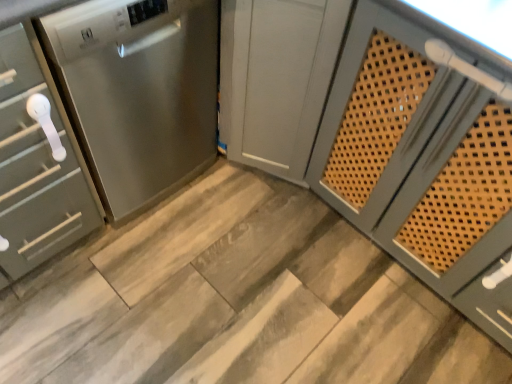
Question: Is satin silver cabinet at left, which is the 1th cabinetry in left-to-right order, further to the viewer compared to wooden at center?

Choices:
 (A) no
 (B) yes

Answer: (A)

Question: Is satin silver cabinet at left, which ranks as the 2th cabinetry in right-to-left order, to the right of wooden at center from the viewer's perspective?

Choices:
 (A) no
 (B) yes

Answer: (A)

Question: From the image's perspective, does satin silver cabinet at left, which is the 1th cabinetry in left-to-right order, appear lower than wooden at center?

Choices:
 (A) no
 (B) yes

Answer: (A)

Question: Is satin silver cabinet at left, which is the 1th cabinetry in left-to-right order, located outside wooden at center?

Choices:
 (A) no
 (B) yes

Answer: (B)

Question: Is the depth of satin silver cabinet at left, which is the 1th cabinetry in left-to-right order, less than that of wooden at center?

Choices:
 (A) yes
 (B) no

Answer: (A)

Question: Is stainless steel dishwasher at left wider or thinner than wooden at center?

Choices:
 (A) thin
 (B) wide

Answer: (A)

Question: Considering their positions, is stainless steel dishwasher at left located in front of or behind wooden at center?

Choices:
 (A) front
 (B) behind

Answer: (A)

Question: Is stainless steel dishwasher at left situated inside wooden at center or outside?

Choices:
 (A) outside
 (B) inside

Answer: (A)

Question: From the image's perspective, relative to wooden at center, is stainless steel dishwasher at left above or below?

Choices:
 (A) above
 (B) below

Answer: (A)

Question: In the image, is satin gray cabinet at center, the 1th cabinetry positioned from the right, on the left side or the right side of stainless steel dishwasher at left?

Choices:
 (A) right
 (B) left

Answer: (A)

Question: Is point (438, 225) positioned closer to the camera than point (145, 142)?

Choices:
 (A) farther
 (B) closer

Answer: (B)

Question: From a real-world perspective, is satin gray cabinet at center, the second cabinetry when ordered from left to right, physically located above or below stainless steel dishwasher at left?

Choices:
 (A) above
 (B) below

Answer: (B)

Question: Considering the positions of satin gray cabinet at center, the 1th cabinetry positioned from the right, and stainless steel dishwasher at left in the image, is satin gray cabinet at center, the 1th cabinetry positioned from the right, taller or shorter than stainless steel dishwasher at left?

Choices:
 (A) tall
 (B) short

Answer: (A)

Question: Looking at their shapes, would you say stainless steel dishwasher at left is wider or thinner than satin silver cabinet at left, which is the 1th cabinetry in left-to-right order?

Choices:
 (A) wide
 (B) thin

Answer: (A)

Question: From the image's perspective, is stainless steel dishwasher at left above or below satin silver cabinet at left, which is the 1th cabinetry in left-to-right order?

Choices:
 (A) below
 (B) above

Answer: (B)